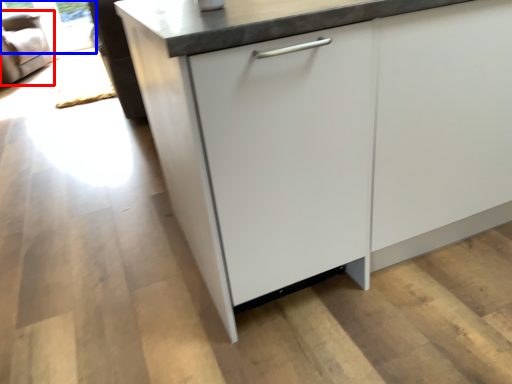
Question: Which object is further to the camera taking this photo, armchair (highlighted by a red box) or window screen (highlighted by a blue box)?

Choices:
 (A) armchair
 (B) window screen

Answer: (B)